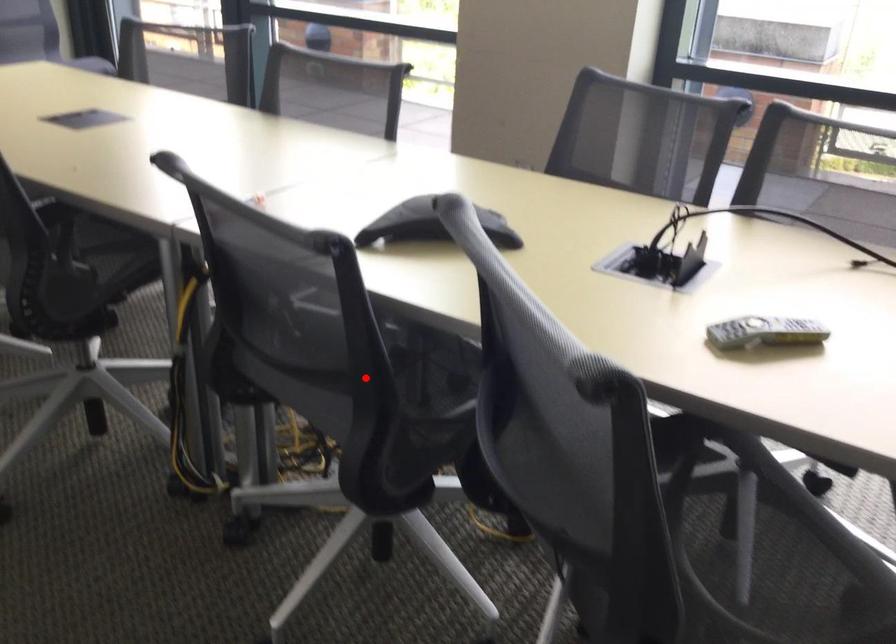
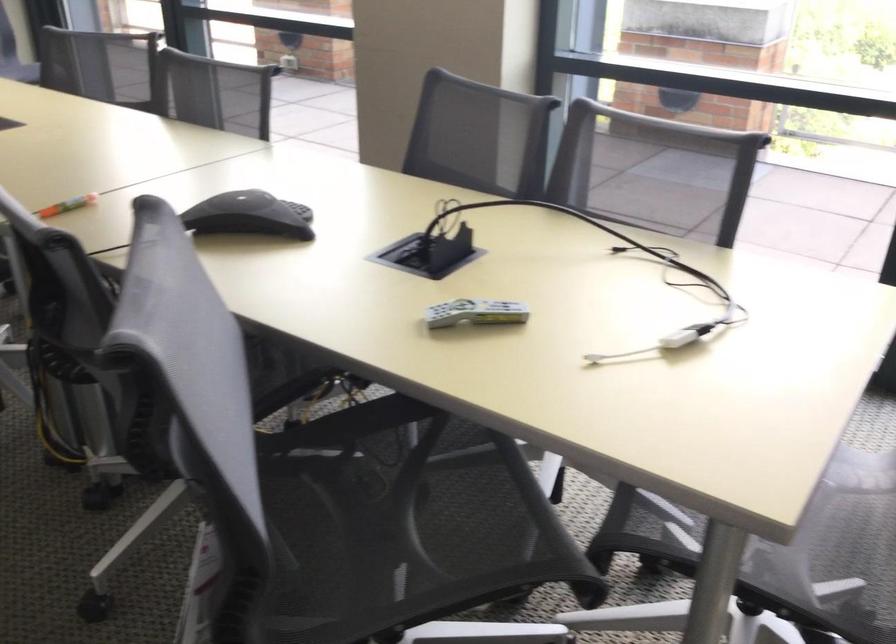
Question: I am providing you with two images of the same scene from different viewpoints. A red point is marked on the first image. At the location where the point appears in image 1, is it still visible in image 2?

Choices:
 (A) Yes
 (B) No

Answer: (B)